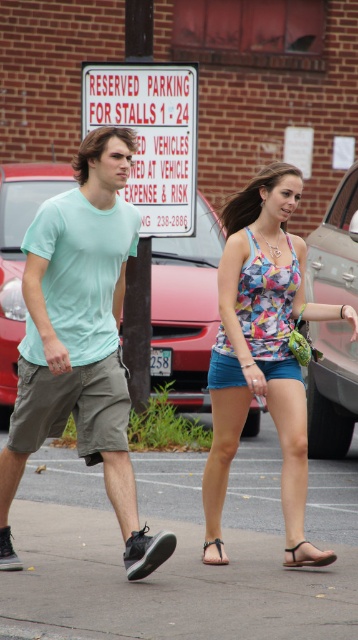
Question: Is gray asphalt pavement at lower center bigger than light blue cotton t-shirt at center?

Choices:
 (A) no
 (B) yes

Answer: (A)

Question: Which of the following is the closest to the observer?

Choices:
 (A) printed fabric tank top at center
 (B) light blue cotton t-shirt at center
 (C) metallic silver car at right
 (D) floral tank top at center

Answer: (B)

Question: Which of the following is the closest to the observer?

Choices:
 (A) (281, 580)
 (B) (307, 563)
 (C) (80, 182)

Answer: (A)

Question: Does printed fabric tank top at center have a smaller size compared to metallic silver car at right?

Choices:
 (A) yes
 (B) no

Answer: (A)

Question: Does floral tank top at center appear on the right side of blue fabric sandal at lower center?

Choices:
 (A) no
 (B) yes

Answer: (A)

Question: Estimate the real-world distances between objects in this image. Which object is farther from the printed fabric tank top at center?

Choices:
 (A) black leather sandal at lower right
 (B) light blue cotton t-shirt at center

Answer: (A)